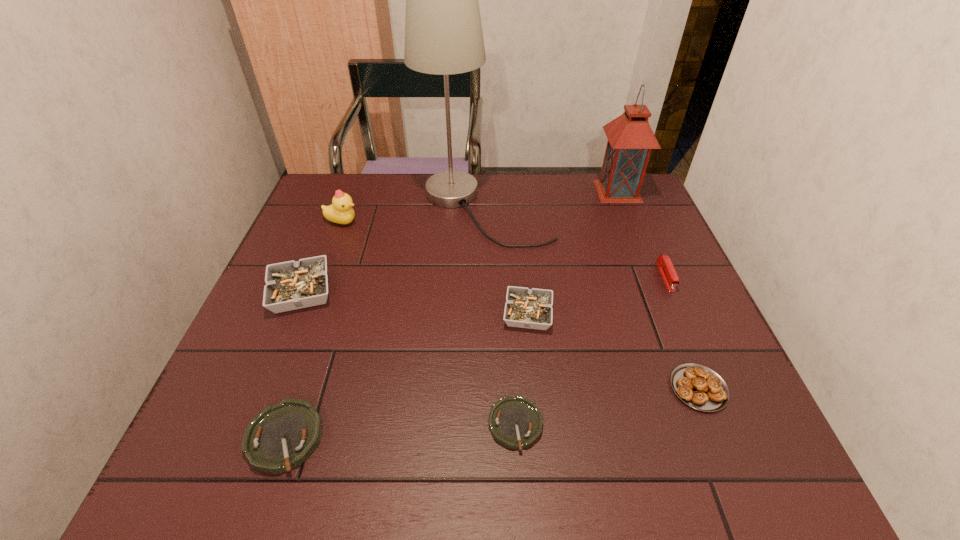
The height and width of the screenshot is (540, 960). Identify the location of the right gray ashtray. (528, 308).

The height and width of the screenshot is (540, 960). Identify the location of pastry. (701, 388).

Where is `the left green ashtray`? The height and width of the screenshot is (540, 960). the left green ashtray is located at coordinates (283, 436).

At what (x,y) coordinates should I click in order to perform the action: click on the bigger green ashtray. Please return your answer as a coordinate pair (x, y). Image resolution: width=960 pixels, height=540 pixels. Looking at the image, I should click on (283, 436).

Locate an element on the screen. the smaller green ashtray is located at coordinates (515, 422).

This screenshot has height=540, width=960. In order to click on the shortest ashtray in this screenshot , I will do `click(515, 422)`.

I want to click on vacant space situated on the left of the tallest object, so click(x=363, y=208).

Where is `vacant space located on the left of the pink lantern`? The image size is (960, 540). vacant space located on the left of the pink lantern is located at coordinates (482, 191).

You are a GUI agent. You are given a task and a screenshot of the screen. Output one action in this format:
    pyautogui.click(x=<x>, y=<y>)
    Task: Click on the vacant space located on the front-facing side of the duckling
    Image resolution: width=960 pixels, height=540 pixels.
    Given the screenshot: What is the action you would take?
    pyautogui.click(x=409, y=222)

At what (x,y) coordinates should I click in order to perform the action: click on vacant position located 0.150m on the back of the bigger gray ashtray. Please return your answer as a coordinate pair (x, y). Looking at the image, I should click on (325, 232).